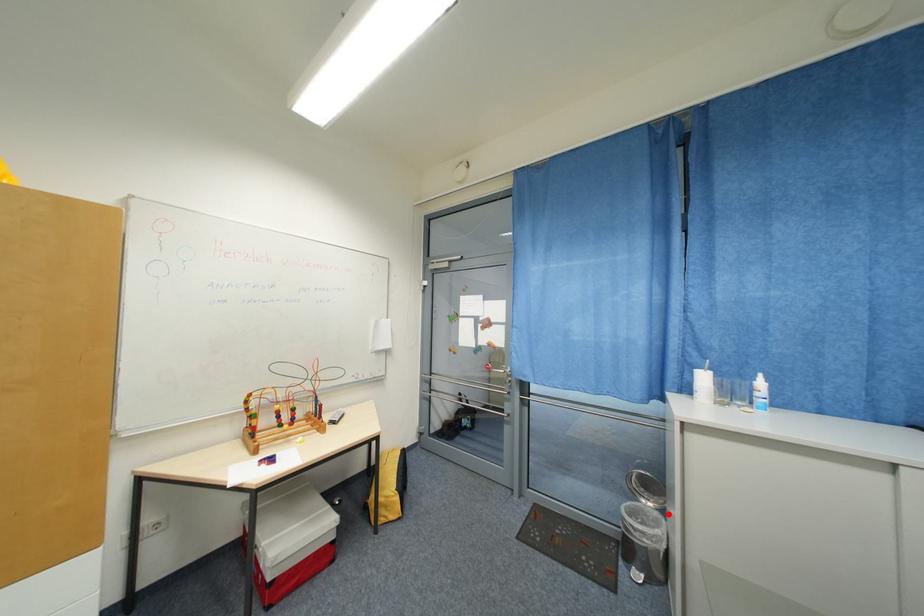
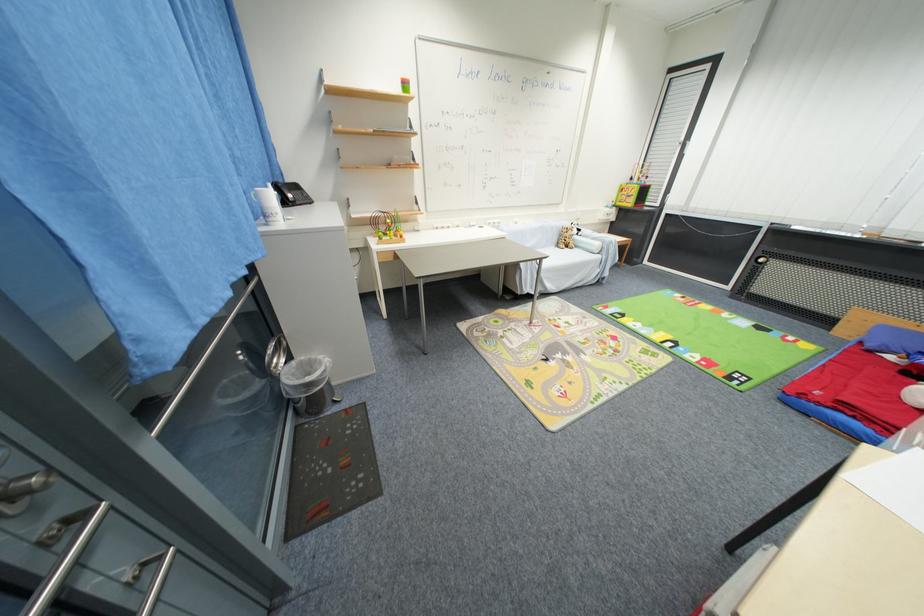
The point at the highlighted location is marked in the first image. Where is the corresponding point in the second image?

(295, 360)